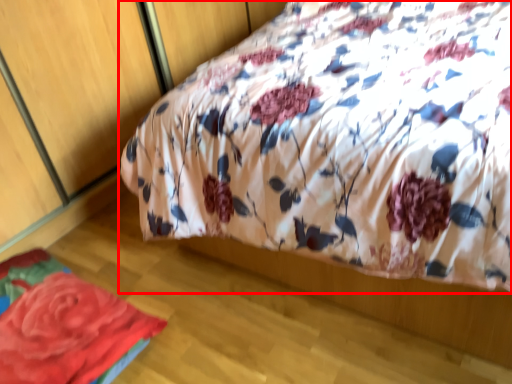
Question: Observing the image, what is the correct spatial positioning of bed (annotated by the red box) in reference to rose?

Choices:
 (A) right
 (B) left

Answer: (A)